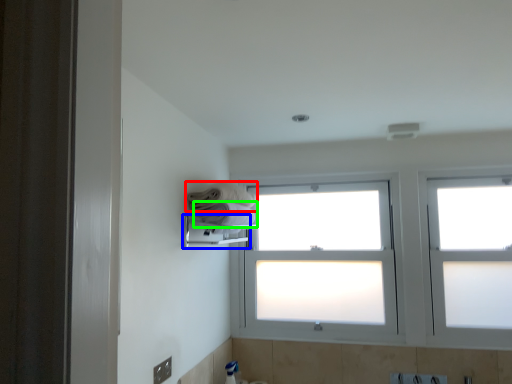
Question: Which object is the closest to the towel (highlighted by a red box)? Choose among these: towel bar (highlighted by a blue box) or towel (highlighted by a green box).

Choices:
 (A) towel bar
 (B) towel

Answer: (B)